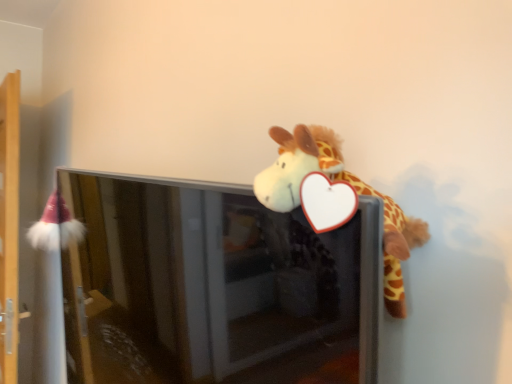
Question: From a real-world perspective, is transparent glass screen door at upper center positioned above or below wooden shelf at left?

Choices:
 (A) below
 (B) above

Answer: (A)

Question: In terms of size, does transparent glass screen door at upper center appear bigger or smaller than wooden shelf at left?

Choices:
 (A) big
 (B) small

Answer: (A)

Question: Considering the relative positions of transparent glass screen door at upper center and wooden shelf at left in the image provided, is transparent glass screen door at upper center to the left or to the right of wooden shelf at left?

Choices:
 (A) left
 (B) right

Answer: (B)

Question: In the image, is wooden shelf at left positioned in front of or behind transparent glass screen door at upper center?

Choices:
 (A) front
 (B) behind

Answer: (B)

Question: Is wooden shelf at left taller or shorter than transparent glass screen door at upper center?

Choices:
 (A) tall
 (B) short

Answer: (A)

Question: Is wooden shelf at left situated inside transparent glass screen door at upper center or outside?

Choices:
 (A) inside
 (B) outside

Answer: (B)

Question: From the image's perspective, is wooden shelf at left positioned above or below transparent glass screen door at upper center?

Choices:
 (A) above
 (B) below

Answer: (A)